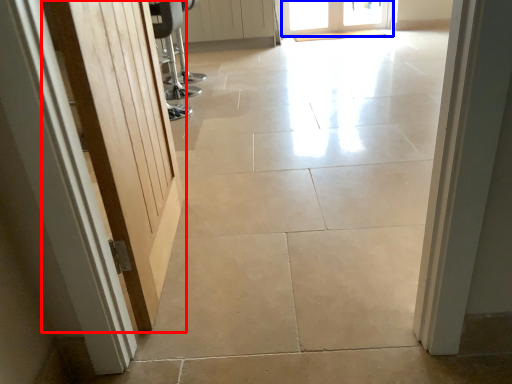
Question: Which object is further to the camera taking this photo, door (highlighted by a red box) or door (highlighted by a blue box)?

Choices:
 (A) door
 (B) door

Answer: (B)